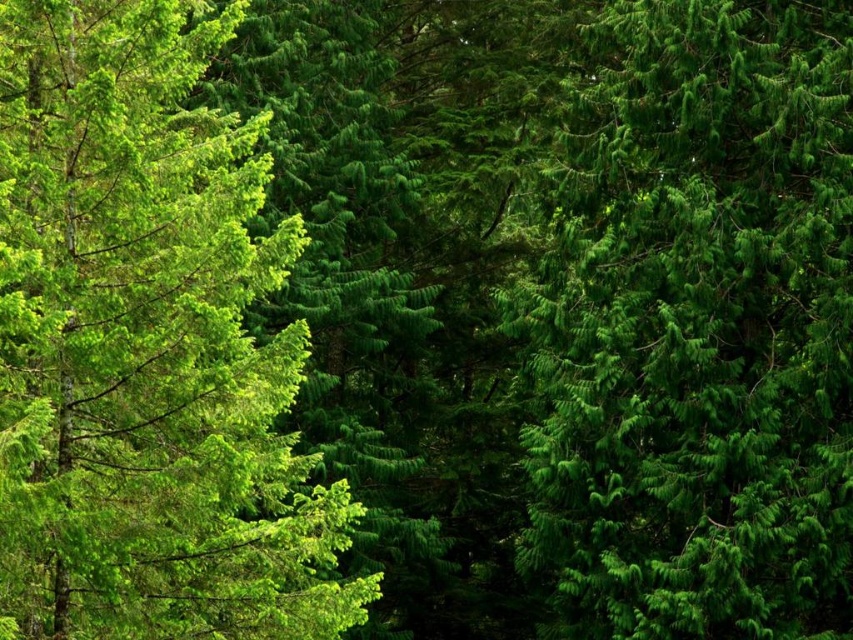
You are standing in the dense forest scene with tall evergreen trees. You notice a specific point labeled as point (698, 328). Which object in the scene does this point lie on?

The point (698, 328) lies on the green matte tree at center.

You are navigating through a dense forest and need to locate the green matte tree at center. According to the coordinates provided, where exactly is the green matte tree positioned in the image?

The green matte tree at center is located at the coordinates point (698, 328).

In the scene shown: You are standing in a dense forest and see a green matte tree at center. If you want to reach the tree within 10 seconds, what is the minimum speed you need to walk towards it?

The green matte tree at center is 56.57 feet away from viewer. To reach it in 10 seconds, you need to walk at a minimum speed of approximately 5.66 feet per second, since 56.57 divided by 10 equals 5.657.